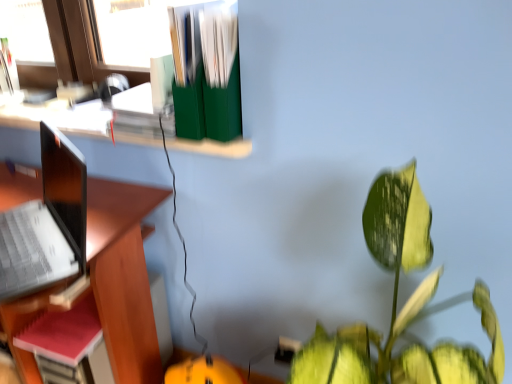
Image resolution: width=512 pixels, height=384 pixels. In order to click on sleek silver laptop at left in this screenshot , I will do `click(47, 224)`.

The image size is (512, 384). What do you see at coordinates (60, 118) in the screenshot? I see `green matte file organizer at upper center` at bounding box center [60, 118].

What is the approximate width of green matte file organizer at upper center?

green matte file organizer at upper center is 9.34 inches wide.

The height and width of the screenshot is (384, 512). Identify the location of green glossy leafy plant at lower right. 406,351.

What is the approximate height of green glossy leafy plant at lower right?

It is 84.55 centimeters.

This screenshot has height=384, width=512. I want to click on red matte notebook at left, so click(63, 334).

Is sleek silver laptop at left aimed at red matte notebook at left?

No, sleek silver laptop at left is not turned towards red matte notebook at left.

Which object is positioned more to the left, sleek silver laptop at left or red matte notebook at left?

Positioned to the left is sleek silver laptop at left.

Is sleek silver laptop at left bigger than red matte notebook at left?

Yes, sleek silver laptop at left is bigger than red matte notebook at left.

Is sleek silver laptop at left taller or shorter than red matte notebook at left?

Considering their sizes, sleek silver laptop at left has more height than red matte notebook at left.

From a real-world perspective, which object stands above the other?

green matte file organizer at upper center, from a real-world perspective.

Is wooden desk at left looking in the opposite direction of green matte file organizer at upper center?

No, wooden desk at left is not facing away from green matte file organizer at upper center.

Is wooden desk at left situated inside green matte file organizer at upper center or outside?

wooden desk at left is not inside green matte file organizer at upper center, it's outside.

Based on the photo, which object is positioned more to the right, wooden desk at left or green matte file organizer at upper center?

Positioned to the right is green matte file organizer at upper center.

Could you tell me if green glossy leafy plant at lower right is turned towards green matte file organizer at upper center?

No, green glossy leafy plant at lower right does not turn towards green matte file organizer at upper center.

Considering the sizes of objects green glossy leafy plant at lower right and green matte file organizer at upper center in the image provided, who is thinner, green glossy leafy plant at lower right or green matte file organizer at upper center?

With smaller width is green matte file organizer at upper center.

Which object is positioned more to the left, green glossy leafy plant at lower right or green matte file organizer at upper center?

green matte file organizer at upper center.

Can you tell me how much green glossy leafy plant at lower right and green matte file organizer at upper center differ in facing direction?

There is a 3.01-degree angle between the facing directions of green glossy leafy plant at lower right and green matte file organizer at upper center.

From the image's perspective, which one is positioned lower, red matte notebook at left or green matte file folders at upper center?

From the image's view, red matte notebook at left is below.

In order to click on book in front of the red matte notebook at left in this screenshot , I will do `click(206, 74)`.

Which of these two, red matte notebook at left or green matte file folders at upper center, is wider?

With larger width is green matte file folders at upper center.

Is red matte notebook at left to the left or to the right of green matte file folders at upper center in the image?

From the image, it's evident that red matte notebook at left is to the left of green matte file folders at upper center.

From a real-world perspective, is green glossy leafy plant at lower right beneath red matte notebook at left?

Actually, green glossy leafy plant at lower right is physically above red matte notebook at left in the real world.

Is red matte notebook at left at the back of green glossy leafy plant at lower right?

No, green glossy leafy plant at lower right is not facing away from red matte notebook at left.

How much distance is there between green glossy leafy plant at lower right and red matte notebook at left?

green glossy leafy plant at lower right and red matte notebook at left are 31.67 inches apart from each other.

Are green glossy leafy plant at lower right and red matte notebook at left beside each other?

green glossy leafy plant at lower right and red matte notebook at left are not in contact.

Considering the relative positions of sleek silver laptop at left and green matte file organizer at upper center in the image provided, is sleek silver laptop at left to the left of green matte file organizer at upper center from the viewer's perspective?

Yes, sleek silver laptop at left is to the left of green matte file organizer at upper center.

In the scene shown: Can you confirm if sleek silver laptop at left is shorter than green matte file organizer at upper center?

No, sleek silver laptop at left is not shorter than green matte file organizer at upper center.

Are sleek silver laptop at left and green matte file organizer at upper center beside each other?

No.

Is sleek silver laptop at left bigger or smaller than green matte file organizer at upper center?

In the image, sleek silver laptop at left appears to be larger than green matte file organizer at upper center.

The width and height of the screenshot is (512, 384). In the image, there is a green glossy leafy plant at lower right. What are the coordinates of `book above it (from the image's perspective)` in the screenshot? It's located at (206, 74).

Considering the sizes of green glossy leafy plant at lower right and green matte file folders at upper center in the image, is green glossy leafy plant at lower right wider or thinner than green matte file folders at upper center?

Clearly, green glossy leafy plant at lower right has more width compared to green matte file folders at upper center.

Is green glossy leafy plant at lower right to the left of green matte file folders at upper center from the viewer's perspective?

In fact, green glossy leafy plant at lower right is to the right of green matte file folders at upper center.

Is point (368, 222) in front of point (229, 48)?

Yes, point (368, 222) is closer to viewer.

This screenshot has height=384, width=512. I want to click on paperback book below the sleek silver laptop at left (from the image's perspective), so click(63, 334).

At what (x,y) coordinates should I click in order to perform the action: click on shelf that appears behind the wooden desk at left. Please return your answer as a coordinate pair (x, y). Looking at the image, I should click on (60, 118).

Consider the image. Looking at the image, which one is located closer to green matte file folders at upper center, sleek silver laptop at left or red matte notebook at left?

The object closer to green matte file folders at upper center is sleek silver laptop at left.

Estimate the real-world distances between objects in this image. Which object is closer to sleek silver laptop at left, green matte file folders at upper center or red matte notebook at left?

red matte notebook at left.

Estimate the real-world distances between objects in this image. Which object is closer to red matte notebook at left, green matte file organizer at upper center or green matte file folders at upper center?

green matte file organizer at upper center lies closer to red matte notebook at left than the other object.

In the scene shown: When comparing their distances from green matte file organizer at upper center, does wooden desk at left or sleek silver laptop at left seem closer?

sleek silver laptop at left is closer to green matte file organizer at upper center.

Looking at the image, which one is located closer to green matte file folders at upper center, wooden desk at left or green glossy leafy plant at lower right?

Among the two, wooden desk at left is located nearer to green matte file folders at upper center.

Looking at the image, which one is located further to red matte notebook at left, wooden desk at left or green matte file organizer at upper center?

Based on the image, green matte file organizer at upper center appears to be further to red matte notebook at left.

Which object lies nearer to the anchor point wooden desk at left, green matte file organizer at upper center or sleek silver laptop at left?

Based on the image, sleek silver laptop at left appears to be nearer to wooden desk at left.

Estimate the real-world distances between objects in this image. Which object is closer to wooden desk at left, red matte notebook at left or green glossy leafy plant at lower right?

red matte notebook at left.

Image resolution: width=512 pixels, height=384 pixels. I want to click on paperback book between green matte file folders at upper center and green glossy leafy plant at lower right in the up-down direction, so click(63, 334).

Find the location of a particular element. shelf between sleek silver laptop at left and green matte file folders at upper center from left to right is located at coordinates (60, 118).

Where is `book situated between wooden desk at left and green glossy leafy plant at lower right from left to right`? Image resolution: width=512 pixels, height=384 pixels. book situated between wooden desk at left and green glossy leafy plant at lower right from left to right is located at coordinates (206, 74).

At what (x,y) coordinates should I click in order to perform the action: click on laptop between green matte file organizer at upper center and wooden desk at left in the up-down direction. Please return your answer as a coordinate pair (x, y). The height and width of the screenshot is (384, 512). Looking at the image, I should click on coord(47,224).